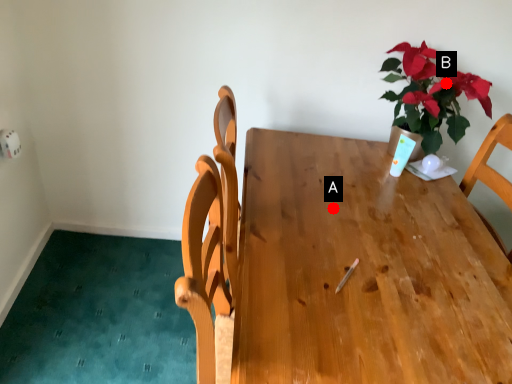
Question: Two points are circled on the image, labeled by A and B beside each circle. Among these points, which one is nearest to the camera?

Choices:
 (A) A is closer
 (B) B is closer

Answer: (A)